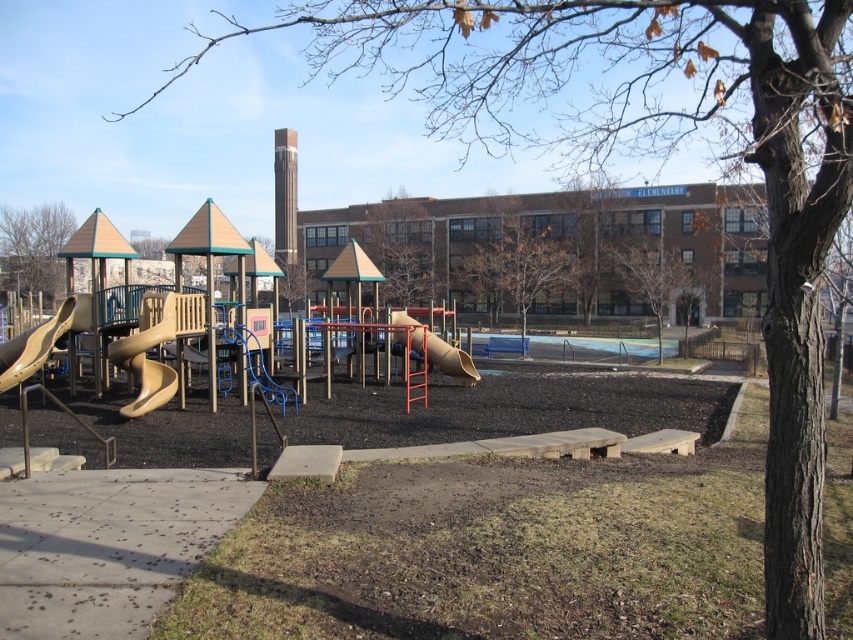
Who is shorter, brown bark tree at center or matte yellow slide at left?

With less height is matte yellow slide at left.

Is point (669, 300) positioned before point (27, 355)?

No, (669, 300) is behind (27, 355).

Is point (650, 307) less distant than point (26, 371)?

No.

Where is `brown bark tree at center`? This screenshot has height=640, width=853. brown bark tree at center is located at coordinates (659, 280).

Who is shorter, brown leafless tree at center or brown bark tree at upper left?

brown bark tree at upper left

Can you confirm if brown leafless tree at center is positioned above brown bark tree at upper left?

Actually, brown leafless tree at center is below brown bark tree at upper left.

Who is more distant from viewer, (424, 282) or (55, 284)?

The point (55, 284) is more distant.

Identify the location of brown leafless tree at center. (401, 248).

How far apart are brown leafless tree at center and beige rubber slide at center?

brown leafless tree at center is 36.27 meters away from beige rubber slide at center.

How far apart are brown leafless tree at center and beige rubber slide at center?

They are 119.00 feet apart.

Find the location of a particular element. brown leafless tree at center is located at coordinates (401, 248).